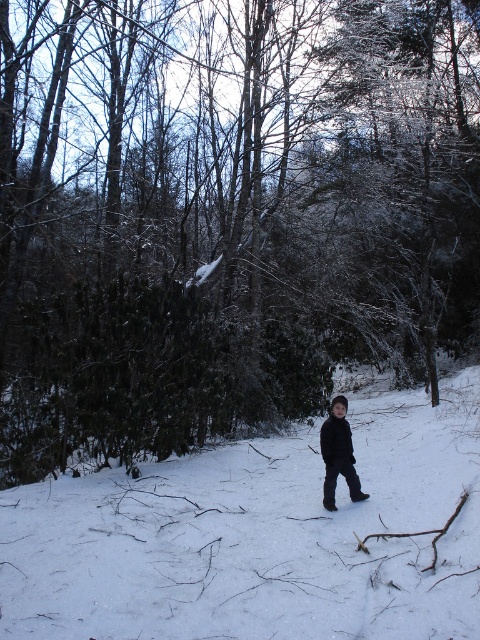
Question: Is white fluffy snow at center smaller than black matte jacket at center?

Choices:
 (A) no
 (B) yes

Answer: (A)

Question: Can you confirm if white fluffy snow at center is smaller than black matte jacket at center?

Choices:
 (A) yes
 (B) no

Answer: (B)

Question: Is white fluffy snow at center bigger than black matte jacket at center?

Choices:
 (A) no
 (B) yes

Answer: (B)

Question: Among these objects, which one is nearest to the camera?

Choices:
 (A) white fluffy snow at center
 (B) black matte jacket at center

Answer: (A)